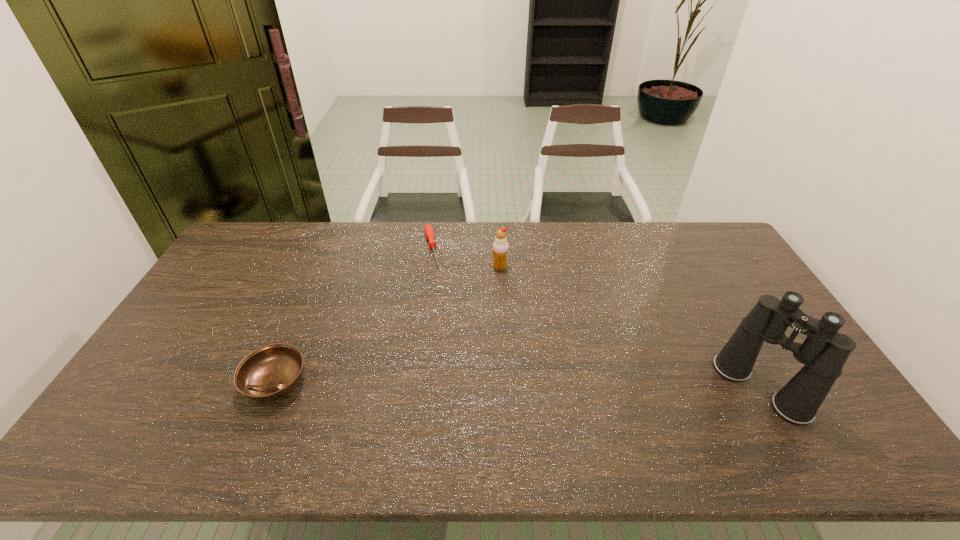
Identify the location of vacant area that lies between the binoculars and the leftmost object. (517, 386).

Locate an element on the screen. The height and width of the screenshot is (540, 960). vacant area that lies between the icecream and the second object from left to right is located at coordinates (466, 258).

Locate an element on the screen. Image resolution: width=960 pixels, height=540 pixels. free area in between the third object from right to left and the icecream is located at coordinates (466, 258).

You are a GUI agent. You are given a task and a screenshot of the screen. Output one action in this format:
    pyautogui.click(x=<x>, y=<y>)
    Task: Click on the free point between the second tallest object and the third tallest object
    The image size is (960, 540).
    Given the screenshot: What is the action you would take?
    pyautogui.click(x=388, y=325)

Identify the location of vacant area that lies between the second object from left to right and the second shortest object. (353, 315).

The image size is (960, 540). Find the location of `free spot between the icecream and the second shortest object`. free spot between the icecream and the second shortest object is located at coordinates (388, 325).

Where is `object that is the third closest to the binoculars`? The height and width of the screenshot is (540, 960). object that is the third closest to the binoculars is located at coordinates (269, 373).

The image size is (960, 540). I want to click on object that is the third closest to the shortest object, so click(824, 352).

Where is `vacant space that satisfies the following two spatial constraints: 1. on the front side of the icecream; 2. on the left side of the tallest object`? This screenshot has width=960, height=540. vacant space that satisfies the following two spatial constraints: 1. on the front side of the icecream; 2. on the left side of the tallest object is located at coordinates (506, 388).

You are a GUI agent. You are given a task and a screenshot of the screen. Output one action in this format:
    pyautogui.click(x=<x>, y=<y>)
    Task: Click on the free region that satisfies the following two spatial constraints: 1. on the front side of the icecream; 2. on the left side of the shortest object
    This screenshot has height=540, width=960.
    Given the screenshot: What is the action you would take?
    pyautogui.click(x=429, y=267)